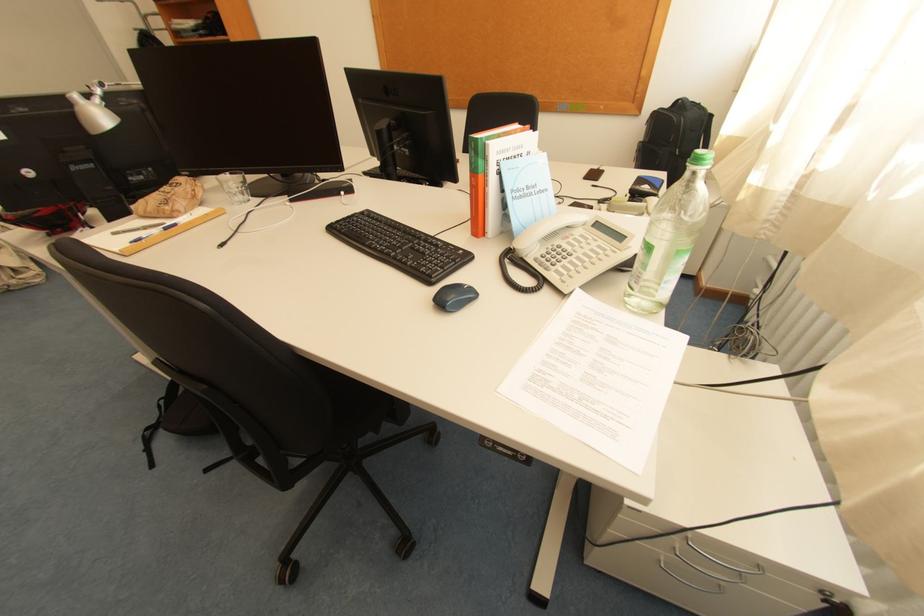
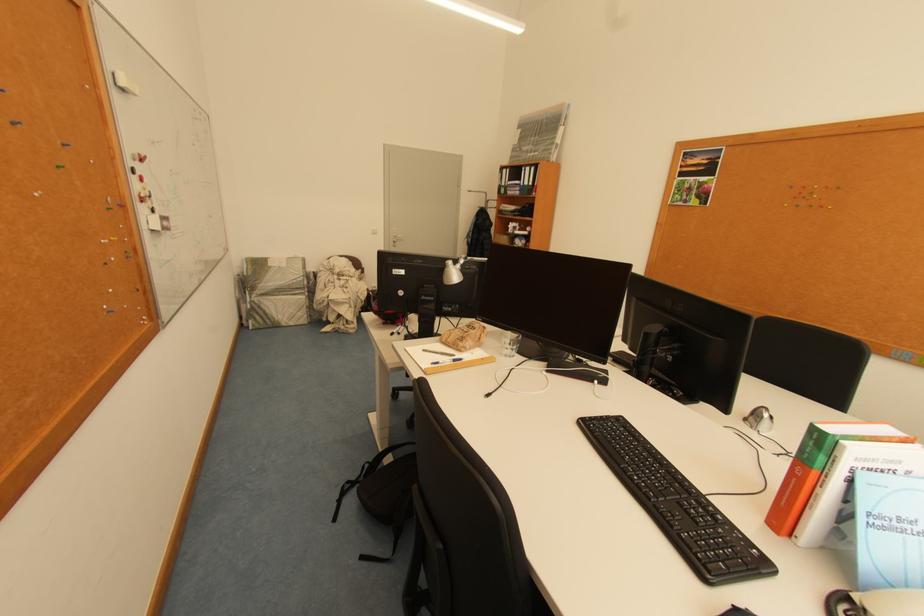
Question: The first image is from the beginning of the video and the second image is from the end. How did the camera likely rotate when shooting the video?

Choices:
 (A) Left
 (B) Right
 (C) Up
 (D) Down

Answer: (A)